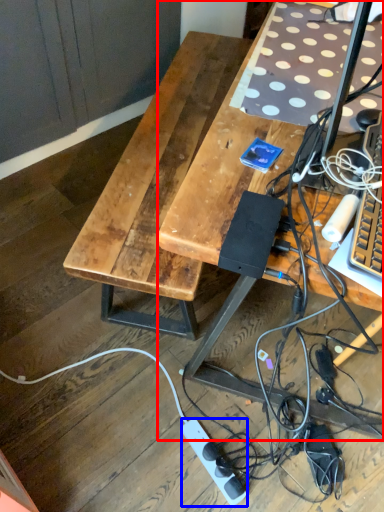
Question: Which object is closer to the camera taking this photo, desk (highlighted by a red box) or power outlet (highlighted by a blue box)?

Choices:
 (A) desk
 (B) power outlet

Answer: (A)